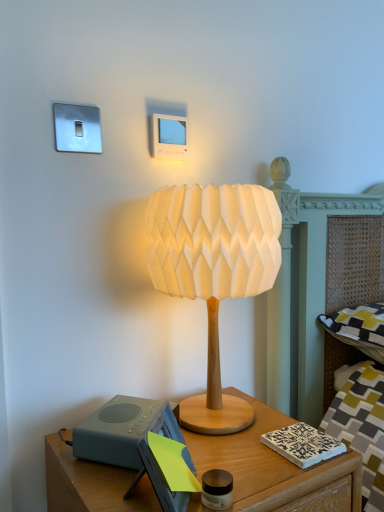
Image resolution: width=384 pixels, height=512 pixels. Identify the location of wooden nightstand at lower center. (276, 468).

Is point (206, 212) less distant than point (239, 447)?

Yes, it is in front of point (239, 447).

Find the location of `lamp above the wooden nightstand at lower center (from a real-world perspective)`. lamp above the wooden nightstand at lower center (from a real-world perspective) is located at coordinates (213, 272).

Measure the distance from white paper lampshade at center to wooden nightstand at lower center.

white paper lampshade at center is 8.36 inches from wooden nightstand at lower center.

Between white paper lampshade at center and wooden nightstand at lower center, which one has smaller width?

Thinner between the two is white paper lampshade at center.

Considering the positions of objects gray matte speaker at lower left and white paper lampshade at center in the image provided, who is in front, gray matte speaker at lower left or white paper lampshade at center?

white paper lampshade at center is more forward.

Which is further, (x=109, y=416) or (x=274, y=229)?

Positioned behind is point (x=274, y=229).

Is the surface of gray matte speaker at lower left in direct contact with white paper lampshade at center?

gray matte speaker at lower left and white paper lampshade at center are not in contact.

From a real-world perspective, is white paper lampshade at center physically above gray matte speaker at lower left?

Correct, in the physical world, white paper lampshade at center is higher than gray matte speaker at lower left.

Does white paper lampshade at center have a greater width compared to gray matte speaker at lower left?

Indeed, white paper lampshade at center has a greater width compared to gray matte speaker at lower left.

Based on the photo, is white paper lampshade at center not near gray matte speaker at lower left?

That's not correct — white paper lampshade at center is a little close to gray matte speaker at lower left.

Is white paper lampshade at center positioned with its back to gray matte speaker at lower left?

That's not correct — white paper lampshade at center is not looking away from gray matte speaker at lower left.

Is wooden nightstand at lower center to the right of gray matte speaker at lower left from the viewer's perspective?

Indeed, wooden nightstand at lower center is positioned on the right side of gray matte speaker at lower left.

From a real-world perspective, is wooden nightstand at lower center beneath gray matte speaker at lower left?

Correct, in the physical world, wooden nightstand at lower center is lower than gray matte speaker at lower left.

Between wooden nightstand at lower center and gray matte speaker at lower left, which one is positioned in front?

wooden nightstand at lower center is in front.

Find the location of a particular element. speaker lying above the wooden nightstand at lower center (from the image's perspective) is located at coordinates (116, 431).

In the scene shown: Is wooden nightstand at lower center surrounded by gray matte speaker at lower left?

No, wooden nightstand at lower center is not a part of gray matte speaker at lower left.

Who is taller, gray matte speaker at lower left or wooden nightstand at lower center?

wooden nightstand at lower center is taller.

Does wooden nightstand at lower center turn towards white paper lampshade at center?

No, wooden nightstand at lower center is not aimed at white paper lampshade at center.

Is white paper lampshade at center surrounded by wooden nightstand at lower center?

No, white paper lampshade at center is not surrounded by wooden nightstand at lower center.

Which is more to the right, wooden nightstand at lower center or white paper lampshade at center?

white paper lampshade at center is more to the right.

Is the position of wooden nightstand at lower center less distant than that of white paper lampshade at center?

Yes, wooden nightstand at lower center is closer to the camera.

Find the location of a particular element. This screenshot has width=384, height=512. nightstand below the white paper lampshade at center (from the image's perspective) is located at coordinates (276, 468).

You are a GUI agent. You are given a task and a screenshot of the screen. Output one action in this format:
    pyautogui.click(x=<x>, y=<y>)
    Task: Click on the speaker that appears on the left of white paper lampshade at center
    This screenshot has height=512, width=384.
    Given the screenshot: What is the action you would take?
    coord(116,431)

From the picture: From the image, which object appears to be nearer to wooden nightstand at lower center, white paper lampshade at center or gray matte speaker at lower left?

gray matte speaker at lower left lies closer to wooden nightstand at lower center than the other object.

Looking at the image, which one is located further to gray matte speaker at lower left, wooden nightstand at lower center or white paper lampshade at center?

Among the two, white paper lampshade at center is located further to gray matte speaker at lower left.

Considering their positions, is gray matte speaker at lower left positioned closer to wooden nightstand at lower center than white paper lampshade at center?

Among the two, gray matte speaker at lower left is located nearer to wooden nightstand at lower center.

Considering their positions, is wooden nightstand at lower center positioned further to white paper lampshade at center than gray matte speaker at lower left?

wooden nightstand at lower center is positioned further to the anchor white paper lampshade at center.

Looking at this image, which object lies nearer to the anchor point gray matte speaker at lower left, white paper lampshade at center or wooden nightstand at lower center?

wooden nightstand at lower center.

When comparing their distances from white paper lampshade at center, does gray matte speaker at lower left or wooden nightstand at lower center seem closer?

The object closer to white paper lampshade at center is gray matte speaker at lower left.

Where is `speaker between white paper lampshade at center and wooden nightstand at lower center in the up-down direction`? This screenshot has width=384, height=512. speaker between white paper lampshade at center and wooden nightstand at lower center in the up-down direction is located at coordinates (116, 431).